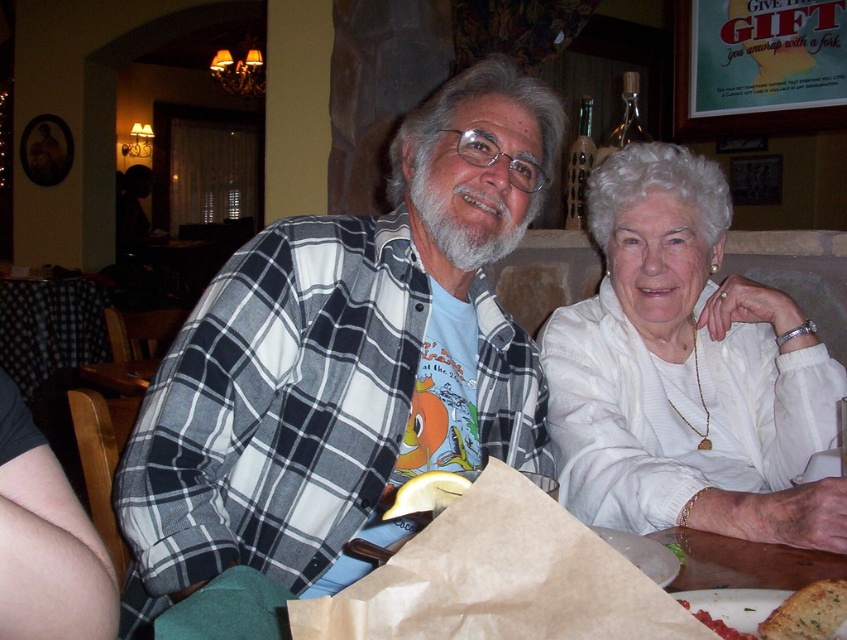
You are a waiter in a restaurant and need to place a new dish exactly at the same 2D location as the yellow rubbery lemon at center. What are the coordinates you should aim for?

The coordinates for the yellow rubbery lemon at center are at point [425,493], so you should aim for those coordinates to place the new dish.

Consider the image. You are a photographer taking a picture of the brown paper bag at lower center and the golden brown bread at lower right. Which object will appear larger in the photo?

The brown paper bag at lower center is closer to the viewer than the golden brown bread at lower right, so it will appear larger in the photo.